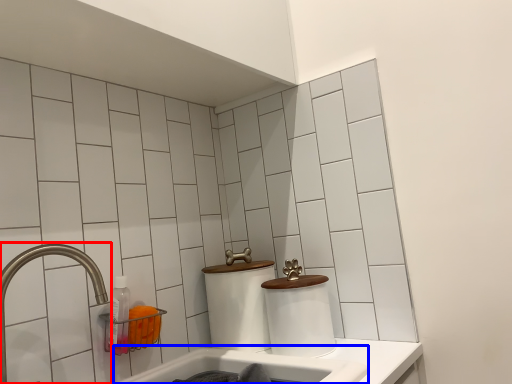
Question: Which point is closer to the camera, tap (highlighted by a red box) or bath (highlighted by a blue box)?

Choices:
 (A) tap
 (B) bath

Answer: (A)